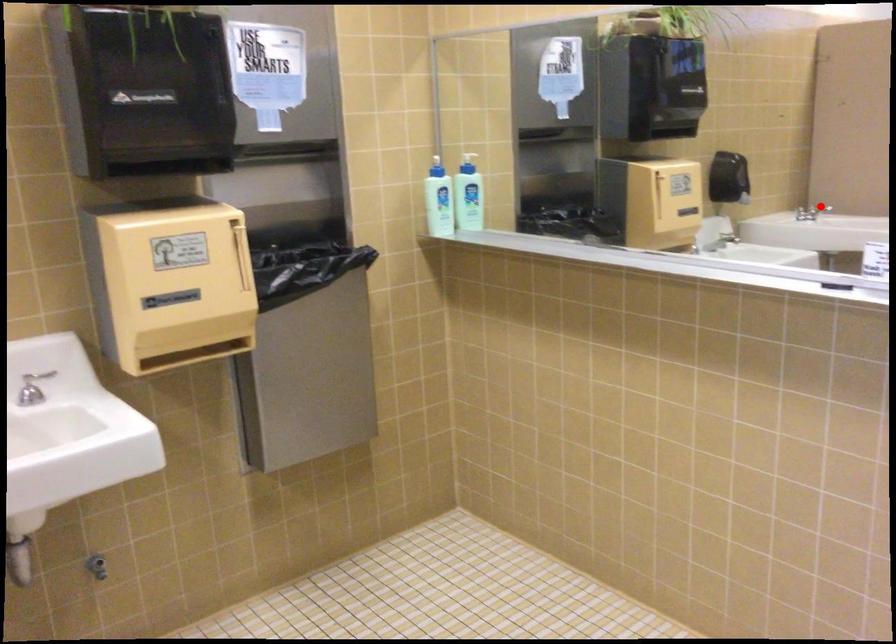
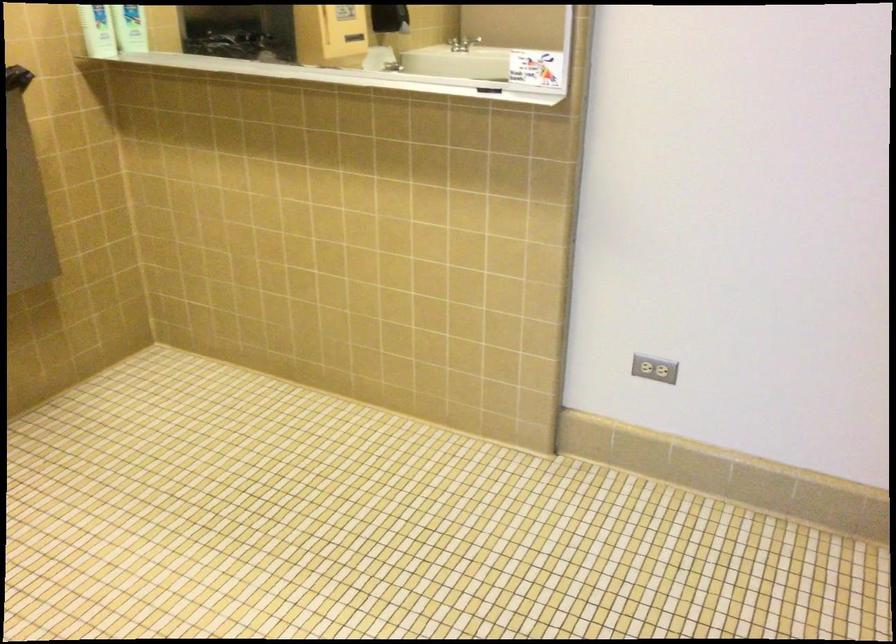
Question: I am providing you with two images of the same scene from different viewpoints. Given a red point in image1, look at the same physical point in image2. Is it:

Choices:
 (A) Closer to the viewpoint
 (B) Farther from the viewpoint

Answer: (B)